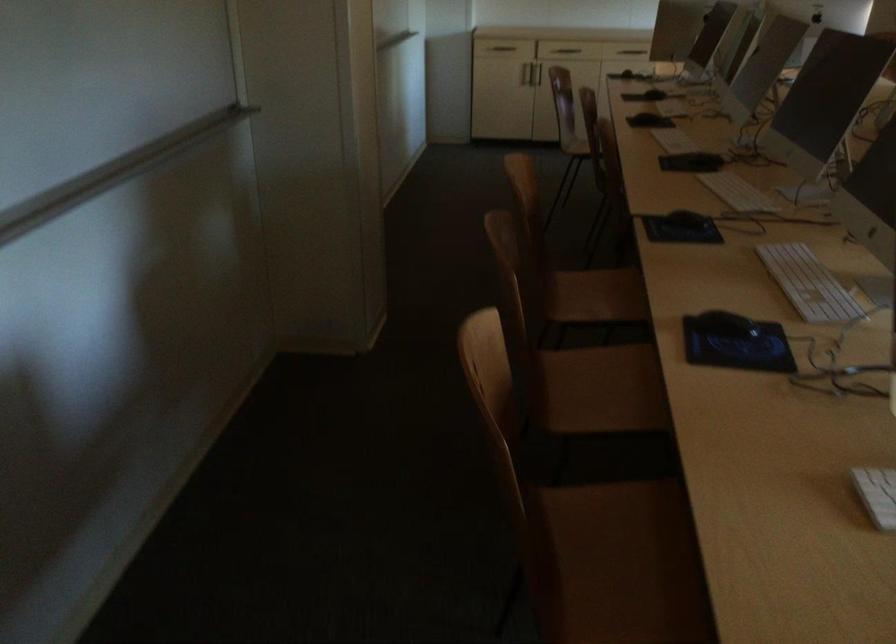
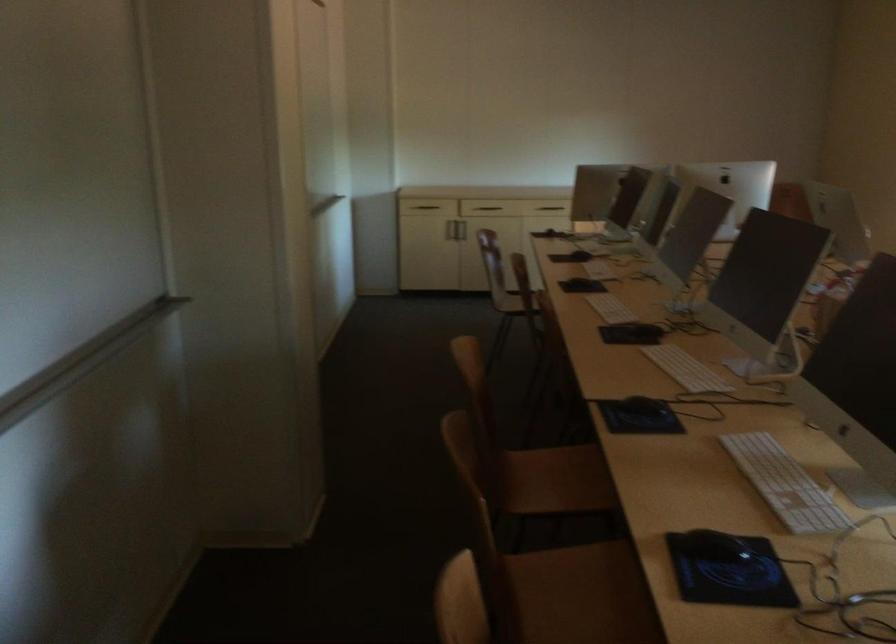
Locate, in the second image, the point that corresponds to the point at 810,281 in the first image.

(784, 484)